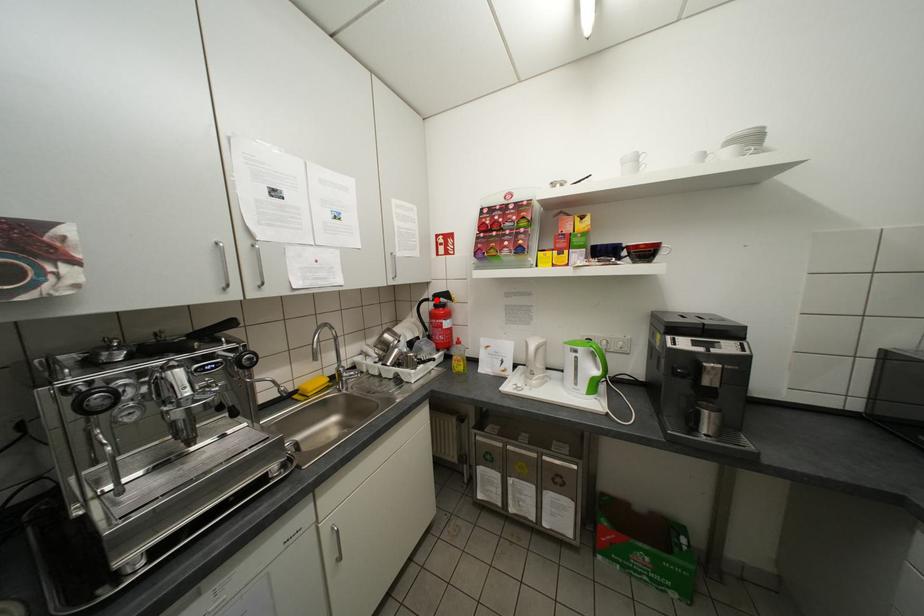
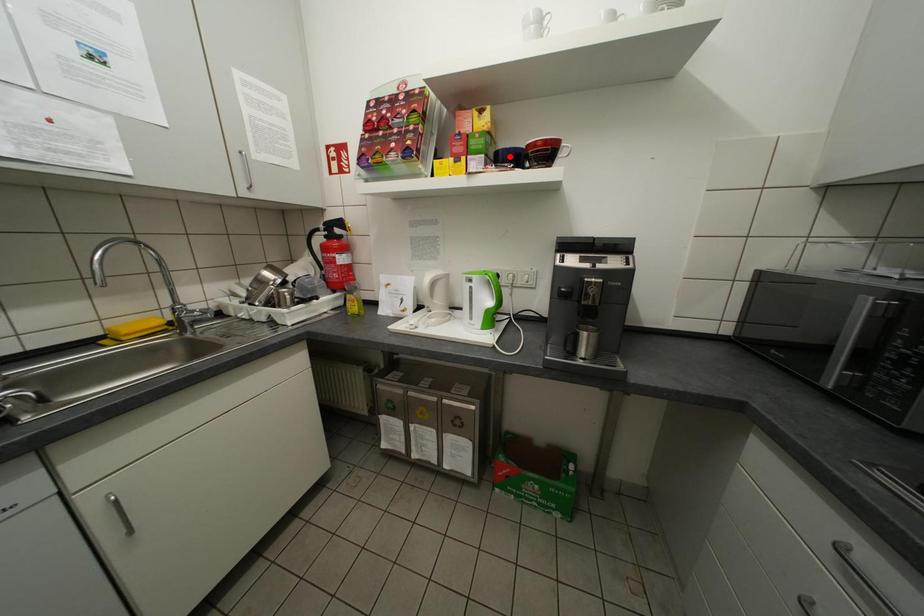
I am providing you with two images of the same scene from different viewpoints. A red point is marked on the first image and another point is marked on the second image. Does the point marked in image1 correspond to the same location as the one in image2?

No